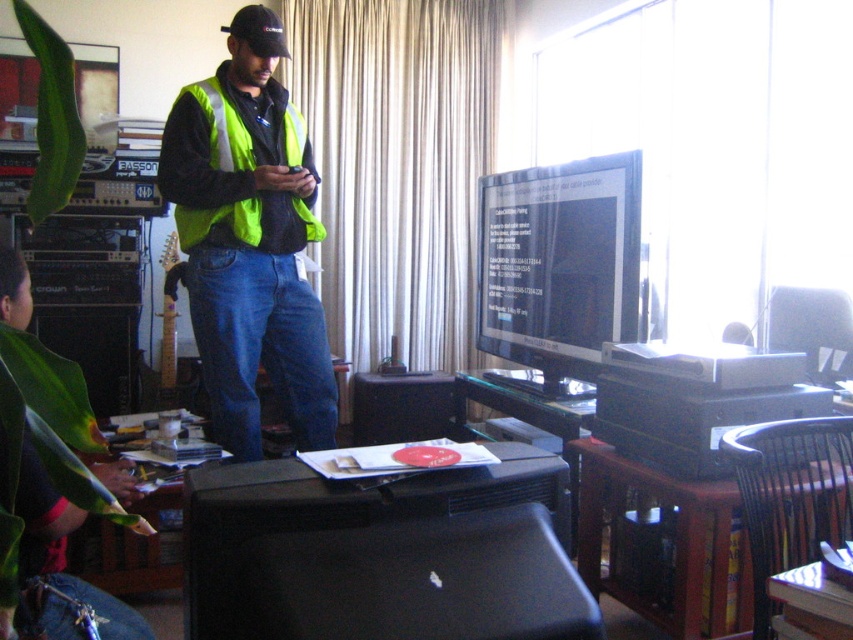
Question: Is high visibility vest at center wider than neon yellow reflective safety vest at center?

Choices:
 (A) no
 (B) yes

Answer: (B)

Question: Which point appears farthest from the camera in this image?

Choices:
 (A) (207, 515)
 (B) (61, 557)
 (C) (236, 116)
 (D) (262, 253)

Answer: (D)

Question: Can you confirm if black matte printer at lower center is wider than dark blue jeans at lower left?

Choices:
 (A) yes
 (B) no

Answer: (A)

Question: Which object is the farthest from the dark blue jeans at lower left?

Choices:
 (A) high visibility vest at center
 (B) neon yellow reflective safety vest at center
 (C) black matte printer at lower center

Answer: (B)

Question: Which point is farther to the camera?

Choices:
 (A) black matte printer at lower center
 (B) dark blue jeans at lower left
 (C) high visibility vest at center

Answer: (C)

Question: Observing the image, what is the correct spatial positioning of high visibility vest at center in reference to dark blue jeans at lower left?

Choices:
 (A) left
 (B) right

Answer: (B)